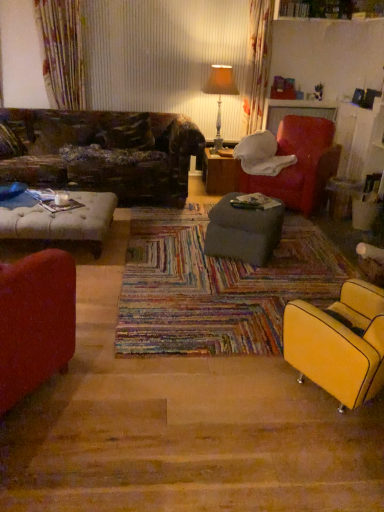
Question: From a real-world perspective, is orange fabric lampshade at upper center located higher than wooden table at center, which is counted as the second table, starting from the front?

Choices:
 (A) yes
 (B) no

Answer: (A)

Question: Does orange fabric lampshade at upper center have a lesser width compared to wooden table at center, which is counted as the second table, starting from the front?

Choices:
 (A) yes
 (B) no

Answer: (A)

Question: Is orange fabric lampshade at upper center smaller than wooden table at center, the 2th table from the bottom?

Choices:
 (A) no
 (B) yes

Answer: (A)

Question: From the image's perspective, does orange fabric lampshade at upper center appear lower than wooden table at center, the 1th table from the top?

Choices:
 (A) no
 (B) yes

Answer: (A)

Question: From a real-world perspective, is orange fabric lampshade at upper center located beneath wooden table at center, the 1th table from the top?

Choices:
 (A) no
 (B) yes

Answer: (A)

Question: In the image, is wooden table at center, the 1th table from the top, on the left side or the right side of gray fabric ottoman at center, which is counted as the first table, starting from the bottom?

Choices:
 (A) left
 (B) right

Answer: (A)

Question: From the image's perspective, is wooden table at center, which is counted as the second table, starting from the front, positioned above or below gray fabric ottoman at center, the 1th table viewed from the front?

Choices:
 (A) below
 (B) above

Answer: (B)

Question: Does point (211, 148) appear closer or farther from the camera than point (274, 231)?

Choices:
 (A) farther
 (B) closer

Answer: (A)

Question: Considering their positions, is wooden table at center, the 2th table from the bottom, located in front of or behind gray fabric ottoman at center, placed as the 2th table when sorted from top to bottom?

Choices:
 (A) front
 (B) behind

Answer: (B)

Question: From their relative heights in the image, would you say wooden table at center, the 2th table from the bottom, is taller or shorter than matte yellow armchair at lower right, which is the second chair from back to front?

Choices:
 (A) tall
 (B) short

Answer: (B)

Question: Would you say wooden table at center, the 2th table from the bottom, is to the left or to the right of matte yellow armchair at lower right, the 1th chair positioned from the bottom, in the picture?

Choices:
 (A) right
 (B) left

Answer: (B)

Question: Does point (208, 174) appear closer or farther from the camera than point (332, 309)?

Choices:
 (A) farther
 (B) closer

Answer: (A)

Question: From a real-world perspective, is wooden table at center, the 1th table from the top, above or below matte yellow armchair at lower right, which ranks as the first chair in front-to-back order?

Choices:
 (A) above
 (B) below

Answer: (B)

Question: In terms of width, does leather-like brown pillow at upper left look wider or thinner when compared to orange fabric lampshade at upper center?

Choices:
 (A) wide
 (B) thin

Answer: (B)

Question: Which is correct: leather-like brown pillow at upper left is inside orange fabric lampshade at upper center, or outside of it?

Choices:
 (A) outside
 (B) inside

Answer: (A)